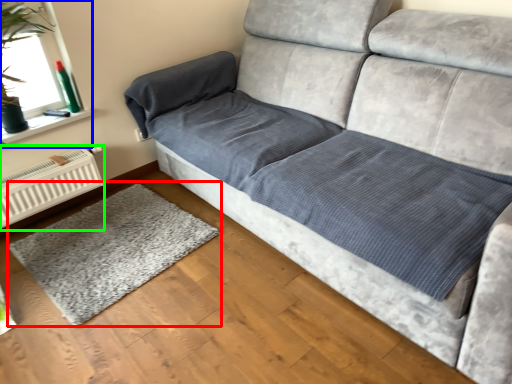
Question: Which is farther away from mat (highlighted by a red box)? window screen (highlighted by a blue box) or radiator (highlighted by a green box)?

Choices:
 (A) window screen
 (B) radiator

Answer: (A)